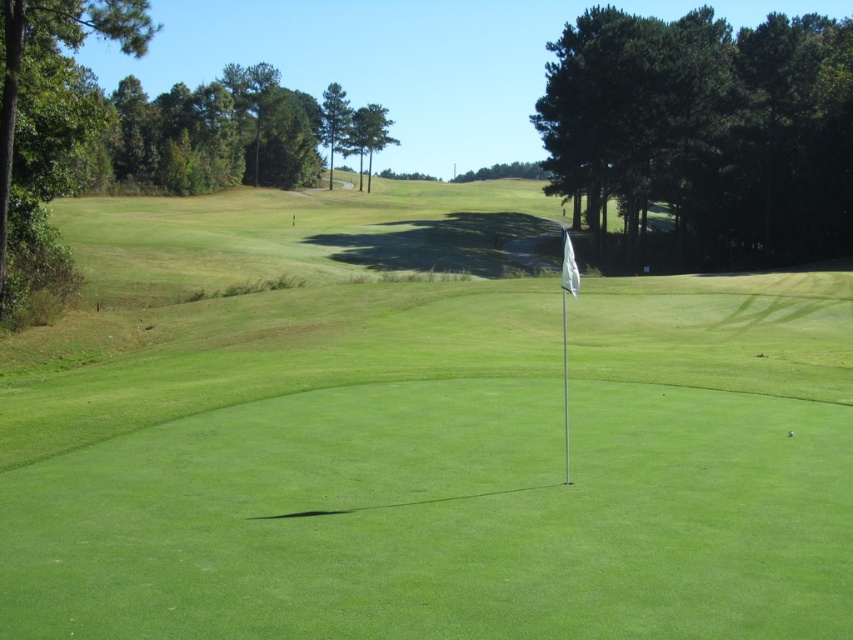
Question: Does green grass flag at center have a lesser width compared to green matte golf ball at center?

Choices:
 (A) yes
 (B) no

Answer: (B)

Question: Which point is closer to the camera taking this photo?

Choices:
 (A) (788, 432)
 (B) (195, 353)

Answer: (A)

Question: Which object is closer to the camera taking this photo?

Choices:
 (A) green matte golf ball at center
 (B) green grass flag at center

Answer: (B)

Question: Which object is farther from the camera taking this photo?

Choices:
 (A) green grass flag at center
 (B) green matte golf ball at center

Answer: (B)

Question: Does green grass flag at center appear over green matte golf ball at center?

Choices:
 (A) yes
 (B) no

Answer: (A)

Question: Does green grass flag at center come in front of green matte golf ball at center?

Choices:
 (A) no
 (B) yes

Answer: (B)